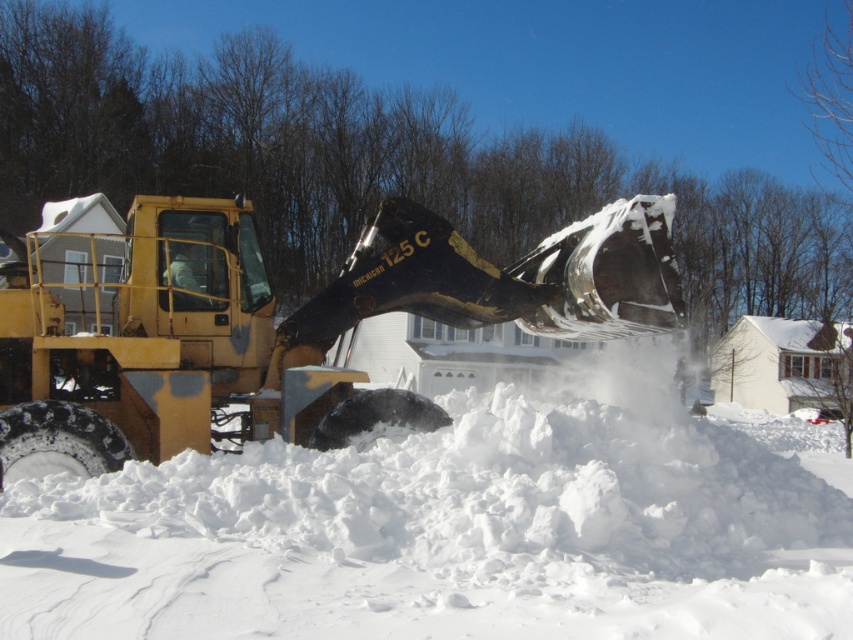
Does white fluffy snow at center have a lesser height compared to yellow metallic tractor at left?

Yes.

Between white fluffy snow at center and yellow metallic tractor at left, which one has more height?

yellow metallic tractor at left is taller.

Between point (152, 614) and point (119, 282), which one is positioned behind?

Point (119, 282)

Locate an element on the screen. white fluffy snow at center is located at coordinates (445, 536).